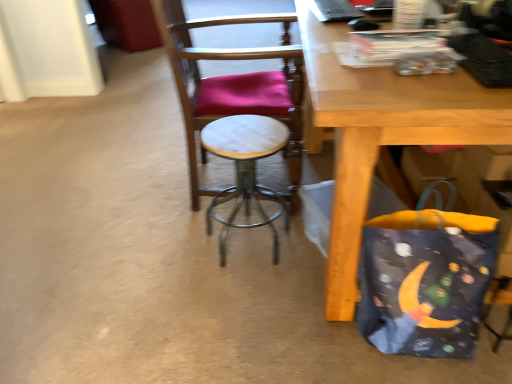
At what (x,y) coordinates should I click in order to perform the action: click on space that is in front of white marble stool at center. Please return your answer as a coordinate pair (x, y). Looking at the image, I should click on (240, 304).